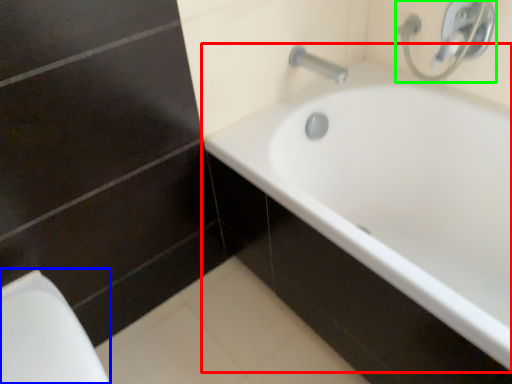
Question: Estimate the real-world distances between objects in this image. Which object is closer to bathtub (highlighted by a red box), porcelain (highlighted by a blue box) or plumbing fixture (highlighted by a green box)?

Choices:
 (A) porcelain
 (B) plumbing fixture

Answer: (B)